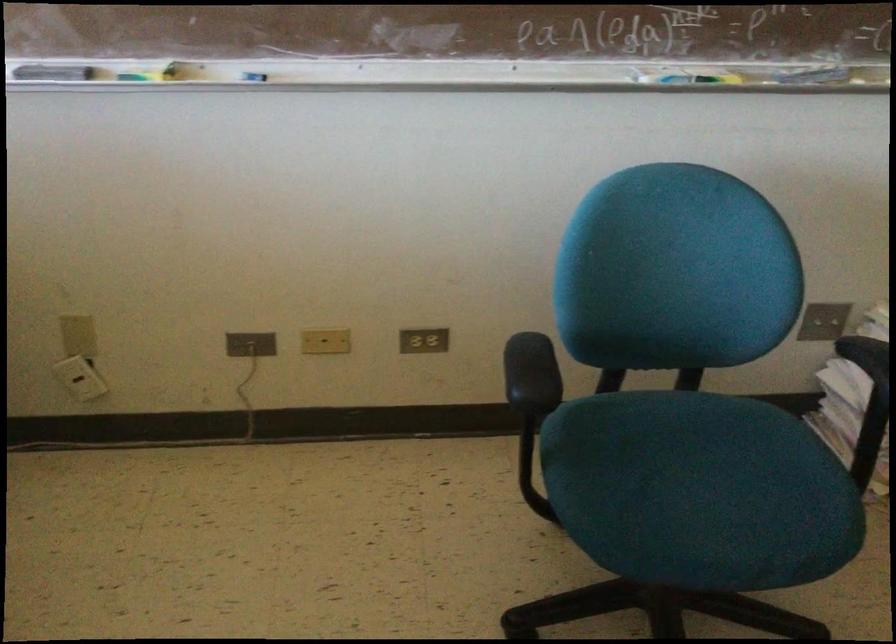
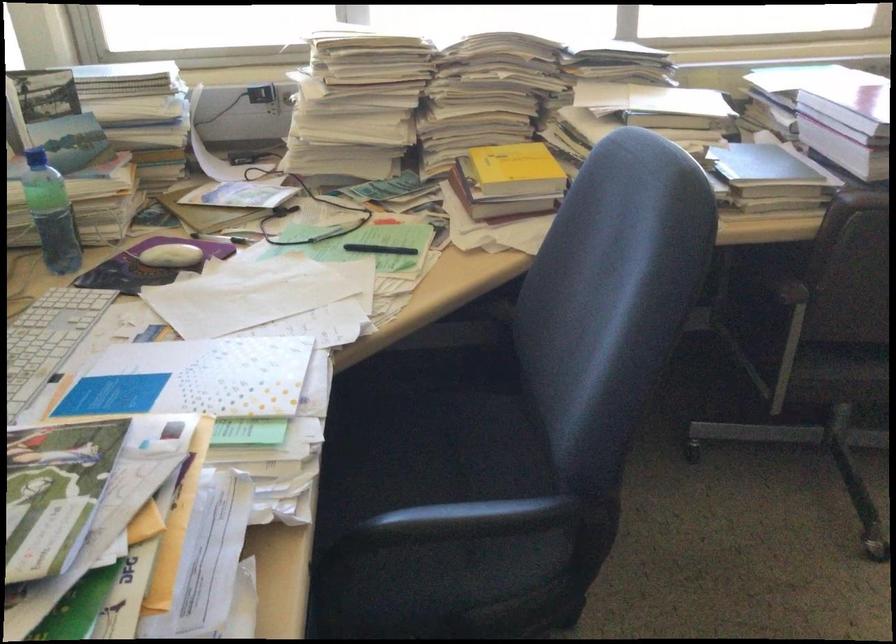
First-person continuous shooting, in which direction is the camera rotating?

The rotation direction of the camera is left-down.